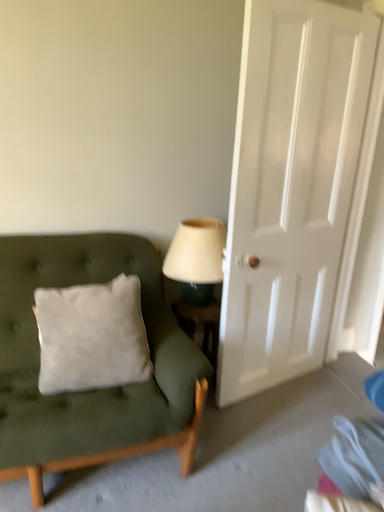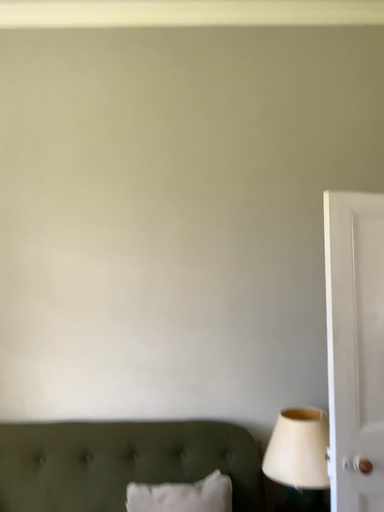
Question: How did the camera likely rotate when shooting the video?

Choices:
 (A) rotated left
 (B) rotated right

Answer: (A)